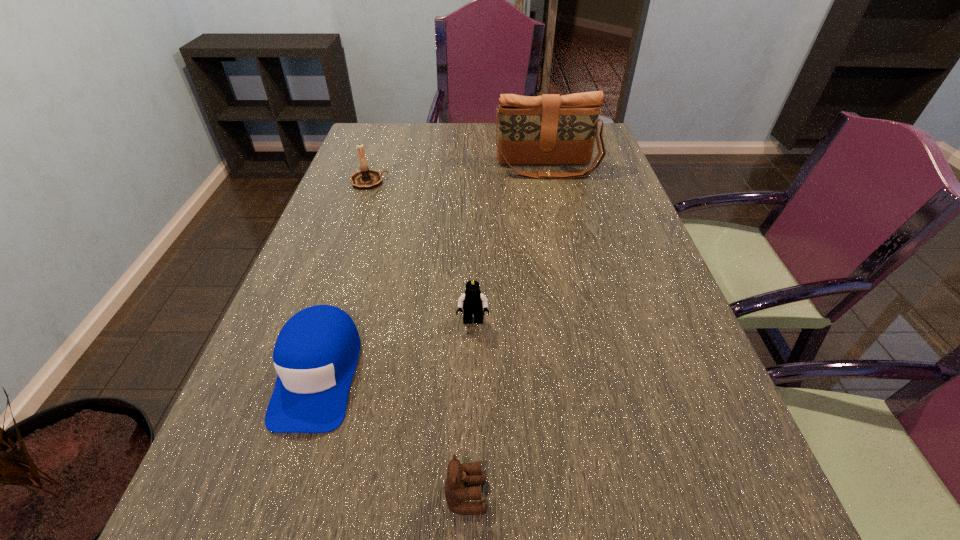
What are the coordinates of `vacant area between the teddy bear and the candle holder` in the screenshot? It's located at (418, 338).

Locate an element on the screen. The height and width of the screenshot is (540, 960). vacant space that's between the Lego and the tallest object is located at coordinates (510, 245).

This screenshot has height=540, width=960. What are the coordinates of `empty space that is in between the shoulder bag and the baseball cap` in the screenshot? It's located at (433, 271).

The width and height of the screenshot is (960, 540). What are the coordinates of `vacant region between the Lego and the nearest object` in the screenshot? It's located at coord(469,409).

In order to click on vacant region between the Lego and the teddy bear in this screenshot , I will do `click(469, 409)`.

Find the location of `unoccupied area between the baseball cap and the teddy bear`. unoccupied area between the baseball cap and the teddy bear is located at coordinates click(x=392, y=435).

Locate an element on the screen. The image size is (960, 540). free spot between the teddy bear and the shoulder bag is located at coordinates (507, 332).

Select which object appears as the fourth closest to the Lego. Please provide its 2D coordinates. Your answer should be formatted as a tuple, i.e. [(x, y)], where the tuple contains the x and y coordinates of a point satisfying the conditions above.

[(550, 129)]

Locate an element on the screen. The height and width of the screenshot is (540, 960). object that is the third nearest to the nearest object is located at coordinates (366, 178).

Identify the location of blank space that satisfies the following two spatial constraints: 1. on the front-facing side of the Lego; 2. on the face of the teddy bear. This screenshot has width=960, height=540. (470, 496).